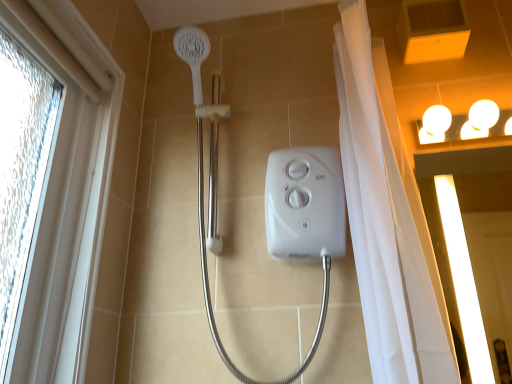
What is the approximate height of white glossy light fixture at upper right?

white glossy light fixture at upper right is 4.64 inches in height.

Locate an element on the screen. This screenshot has width=512, height=384. white glossy screen door at upper right is located at coordinates (474, 246).

Where is `white textured window at left`? The image size is (512, 384). white textured window at left is located at coordinates (67, 191).

Between white glossy screen door at upper right and white glossy light fixture at upper right, which one has smaller width?

white glossy screen door at upper right is thinner.

Relative to white glossy light fixture at upper right, is white glossy screen door at upper right in front or behind?

Clearly, white glossy screen door at upper right is in front of white glossy light fixture at upper right.

From a real-world perspective, who is located higher, white glossy screen door at upper right or white glossy light fixture at upper right?

white glossy light fixture at upper right, from a real-world perspective.

Can we say white glossy screen door at upper right lies outside white glossy light fixture at upper right?

Absolutely, white glossy screen door at upper right is external to white glossy light fixture at upper right.

Does point (502, 128) come closer to viewer compared to point (490, 209)?

Yes, it is.

How different are the orientations of white glossy light fixture at upper right and white glossy screen door at upper right in degrees?

white glossy light fixture at upper right and white glossy screen door at upper right are facing 0.583 degrees away from each other.

Is white glossy light fixture at upper right oriented towards white glossy screen door at upper right?

No, white glossy light fixture at upper right is not turned towards white glossy screen door at upper right.

From a real-world perspective, is white glossy light fixture at upper right under white glossy screen door at upper right?

No, from a real-world perspective, white glossy light fixture at upper right is not under white glossy screen door at upper right.

Is white textured window at left located within white glossy screen door at upper right?

No, white textured window at left is not surrounded by white glossy screen door at upper right.

Is white glossy screen door at upper right placed right next to white textured window at left?

No, white glossy screen door at upper right is not making contact with white textured window at left.

Is point (450, 218) in front of point (83, 373)?

No, (450, 218) is further to viewer.

Does white textured window at left have a greater height compared to white glossy light fixture at upper right?

Yes.

Is white textured window at left looking in the opposite direction of white glossy light fixture at upper right?

No.

Are white textured window at left and white glossy light fixture at upper right making contact?

No, white textured window at left is not touching white glossy light fixture at upper right.

Which point is more distant from viewer, (433, 140) or (21, 336)?

Point (433, 140)

From the picture: Between white glossy light fixture at upper right and white textured window at left, which one has smaller width?

white glossy light fixture at upper right is thinner.

Is white glossy light fixture at upper right turned away from white textured window at left?

white glossy light fixture at upper right is not turned away from white textured window at left.

Between white glossy light fixture at upper right and white textured window at left, which one has larger size?

white textured window at left.

Can you confirm if white textured window at left is smaller than white glossy screen door at upper right?

Incorrect, white textured window at left is not smaller in size than white glossy screen door at upper right.

Is point (50, 346) less distant than point (450, 293)?

Yes, it is in front of point (450, 293).

From a real-world perspective, is white textured window at left positioned under white glossy screen door at upper right based on gravity?

No, from a real-world perspective, white textured window at left is not beneath white glossy screen door at upper right.

Looking at their sizes, would you say white textured window at left is wider or thinner than white glossy screen door at upper right?

Clearly, white textured window at left has more width compared to white glossy screen door at upper right.

The width and height of the screenshot is (512, 384). I want to click on screen door on the left of white glossy light fixture at upper right, so click(x=474, y=246).

This screenshot has width=512, height=384. What are the coordinates of `light fixture above the white glossy screen door at upper right (from a real-world perspective)` in the screenshot? It's located at (470, 124).

When comparing their distances from white glossy screen door at upper right, does white textured window at left or white glossy light fixture at upper right seem further?

white textured window at left lies further to white glossy screen door at upper right than the other object.

Based on the photo, estimate the real-world distances between objects in this image. Which object is further from white glossy light fixture at upper right, white textured window at left or white glossy screen door at upper right?

white textured window at left is further to white glossy light fixture at upper right.

Considering their positions, is white glossy light fixture at upper right positioned closer to white textured window at left than white glossy screen door at upper right?

white glossy light fixture at upper right is positioned closer to the anchor white textured window at left.

Considering their positions, is white glossy screen door at upper right positioned closer to white textured window at left than white glossy light fixture at upper right?

white glossy light fixture at upper right is closer to white textured window at left.

Based on their spatial positions, is white glossy light fixture at upper right or white textured window at left further from white glossy screen door at upper right?

white textured window at left lies further to white glossy screen door at upper right than the other object.

When comparing their distances from white glossy light fixture at upper right, does white glossy screen door at upper right or white textured window at left seem closer?

The object closer to white glossy light fixture at upper right is white glossy screen door at upper right.

Where is `screen door between white textured window at left and white glossy light fixture at upper right`? The height and width of the screenshot is (384, 512). screen door between white textured window at left and white glossy light fixture at upper right is located at coordinates (474, 246).